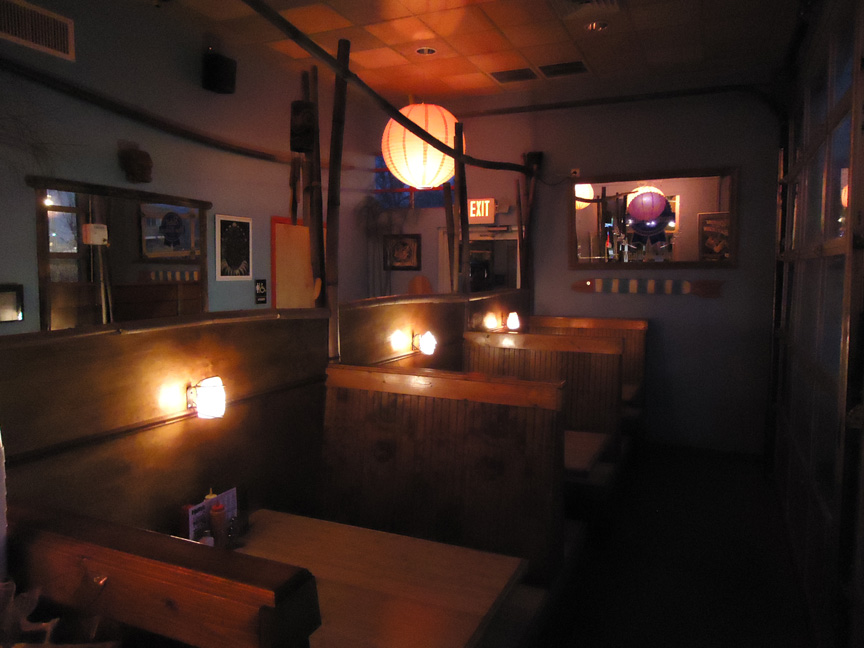
This screenshot has height=648, width=864. What are the coordinates of `round light` in the screenshot? It's located at (x=426, y=170).